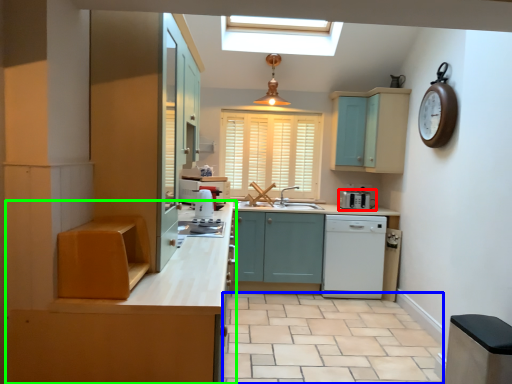
Question: Estimate the real-world distances between objects in this image. Which object is farther from kitchen appliance (highlighted by a red box), tile (highlighted by a blue box) or cabinetry (highlighted by a green box)?

Choices:
 (A) tile
 (B) cabinetry

Answer: (B)